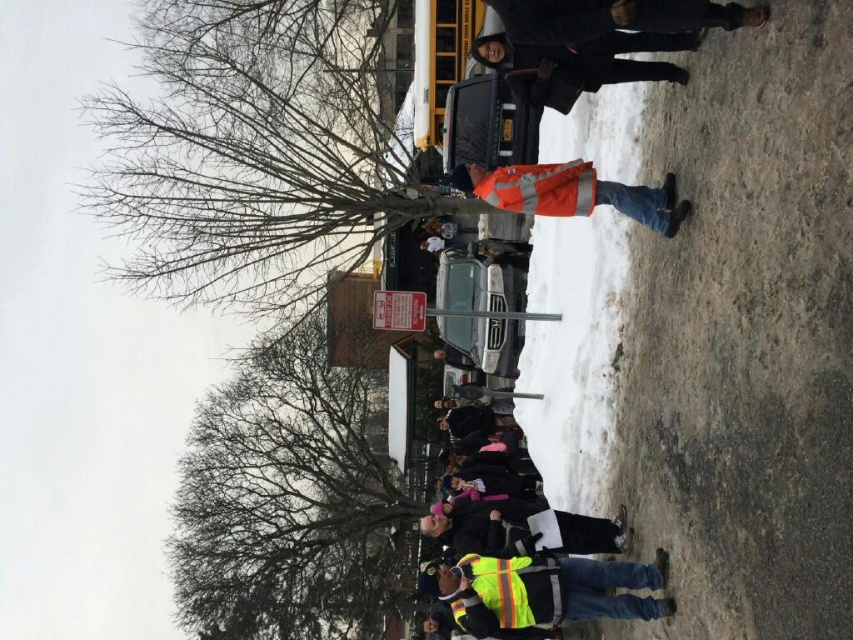
You are standing at the camera position and want to reach the point marked as point (x=634, y=76). There is a fence that is 1.5 meters wide blocking your path. Can you walk around the fence to reach the point?

The point (x=634, y=76) and camera are 18.73 meters apart. Since the fence is only 1.5 meters wide, you can walk around it to reach the point.

You are a delivery person arriving at the No. building and need to locate the emergency exit sign. You see the reflective orange vest at center and the reflective yellow safety vest at lower center. Which vest is nearer to you as you approach the building?

The reflective orange vest at center is closer to the viewer than the reflective yellow safety vest at lower center, so the reflective orange vest at center is nearer to you as you approach the building.

You are a delivery driver who needs to park your metallic silver car at center in a spot that is not blocked by the reflective orange vest at upper center. Can you move the car to a different parking spot?

The reflective orange vest at upper center is above the metallic silver car at center, so the car cannot be moved as the vest is blocking the way.